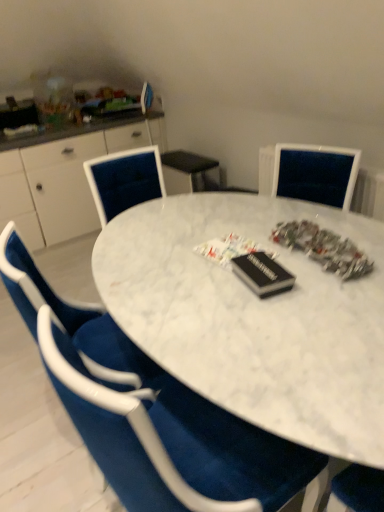
Identify the location of free point above white marble table at center (from a real-world perspective). The image size is (384, 512). 235,247.